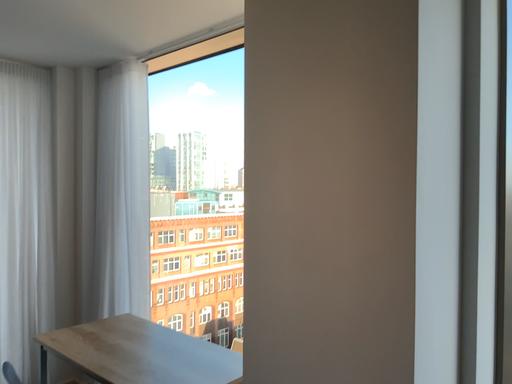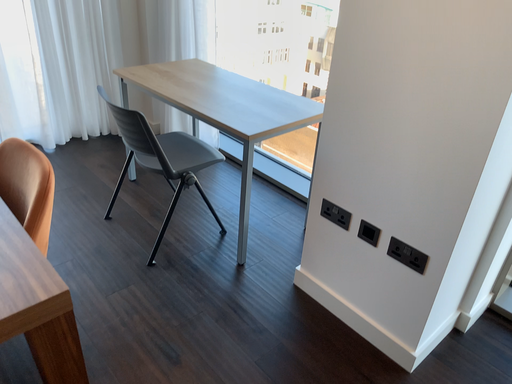
Question: Which way did the camera rotate in the video?

Choices:
 (A) rotated downward
 (B) rotated upward

Answer: (A)